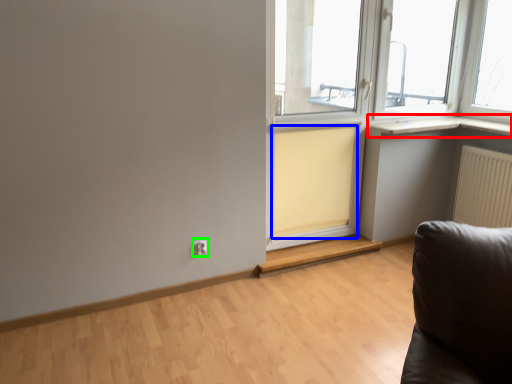
Question: Based on their relative distances, which object is farther from window sill (highlighted by a red box)? Choose from curtain (highlighted by a blue box) and electric outlet (highlighted by a green box).

Choices:
 (A) curtain
 (B) electric outlet

Answer: (B)